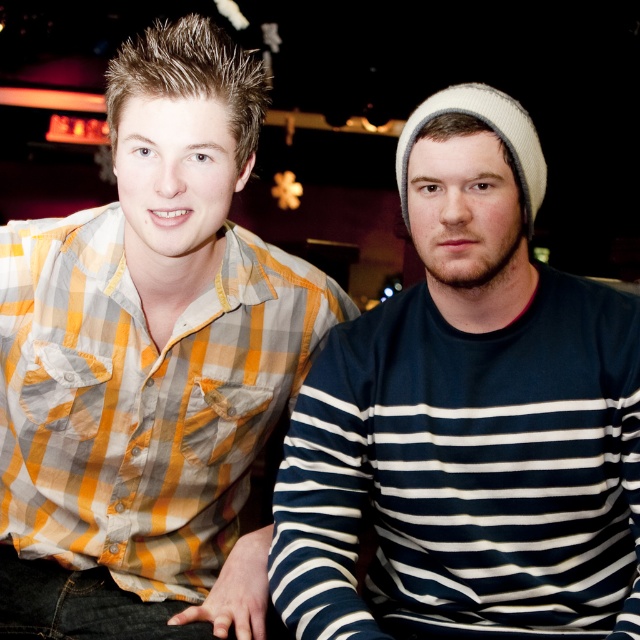
You are a GUI agent. You are given a task and a screenshot of the screen. Output one action in this format:
    pyautogui.click(x=<x>, y=<y>)
    Task: Click on the yellow-orange plaid shirt at left
    
    Given the screenshot: What is the action you would take?
    pyautogui.click(x=148, y=364)

This screenshot has height=640, width=640. What do you see at coordinates (148, 364) in the screenshot?
I see `yellow-orange plaid shirt at left` at bounding box center [148, 364].

Find the location of a particular element. yellow-orange plaid shirt at left is located at coordinates (148, 364).